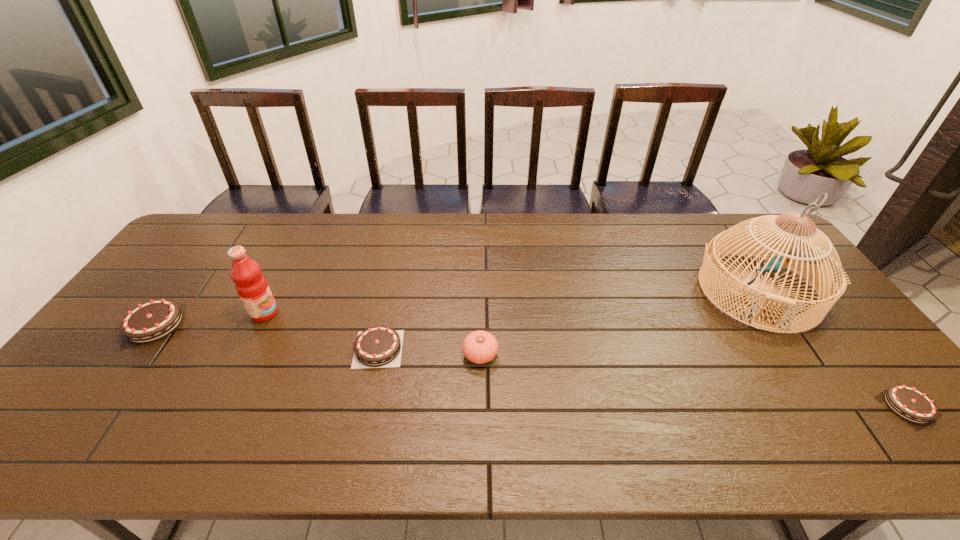
Image resolution: width=960 pixels, height=540 pixels. Find the location of `the fourth object from left to right`. the fourth object from left to right is located at coordinates (480, 347).

The image size is (960, 540). Find the location of `vacant point located 0.220m on the right of the third shortest object`. vacant point located 0.220m on the right of the third shortest object is located at coordinates (267, 325).

Where is `vacant space located 0.360m on the left of the third object from left to right`? This screenshot has height=540, width=960. vacant space located 0.360m on the left of the third object from left to right is located at coordinates (219, 349).

Locate an element on the screen. This screenshot has height=540, width=960. free region located on the left of the nearest chocolate cake is located at coordinates (846, 406).

Where is `free spot located 0.350m on the front label of the fruit juice`? The width and height of the screenshot is (960, 540). free spot located 0.350m on the front label of the fruit juice is located at coordinates (399, 313).

Locate an element on the screen. This screenshot has height=540, width=960. blank area located 0.190m on the back of the tallest object is located at coordinates (712, 222).

Where is `vacant space situated 0.200m on the right of the third object from right to left`? The height and width of the screenshot is (540, 960). vacant space situated 0.200m on the right of the third object from right to left is located at coordinates (574, 355).

Identify the location of object that is at the near edge. This screenshot has width=960, height=540. (909, 403).

Find the location of a particular element. This screenshot has width=960, height=540. object at the left edge is located at coordinates (151, 321).

Where is `chocolate cake located in the right edge section of the desktop`? chocolate cake located in the right edge section of the desktop is located at coordinates (909, 403).